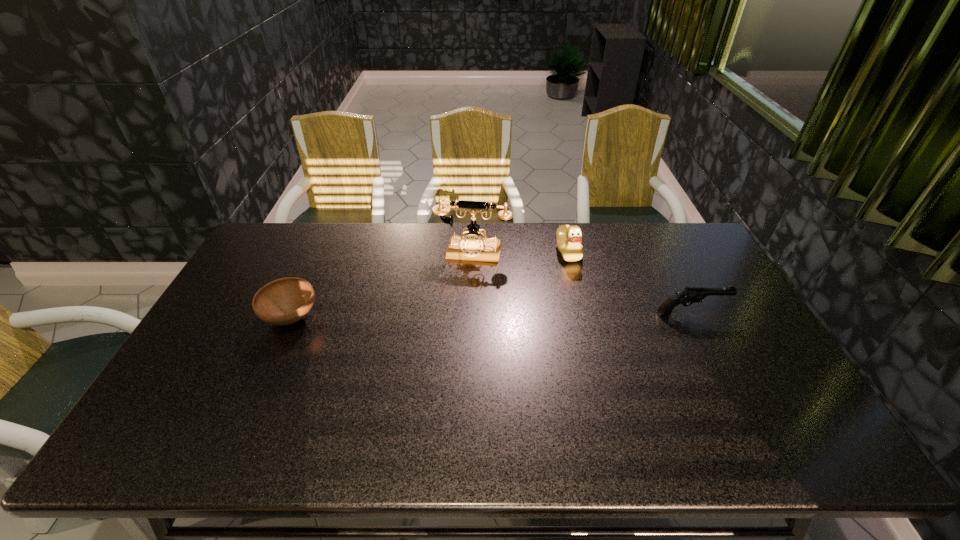
At what (x,y) coordinates should I click in order to perform the action: click on free spot that satisfies the following two spatial constraints: 1. on the front side of the rightmost object; 2. at the end of the barrel of the tallest object. Please return your answer as a coordinate pair (x, y). The width and height of the screenshot is (960, 540). Looking at the image, I should click on (471, 314).